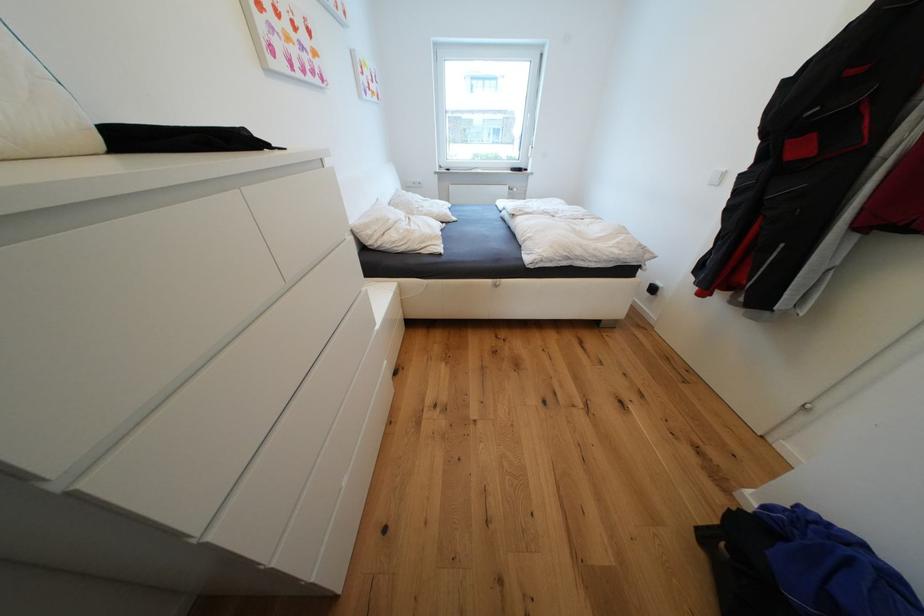
Image resolution: width=924 pixels, height=616 pixels. What are the coordinates of `white window handle` in the screenshot? It's located at (529, 120).